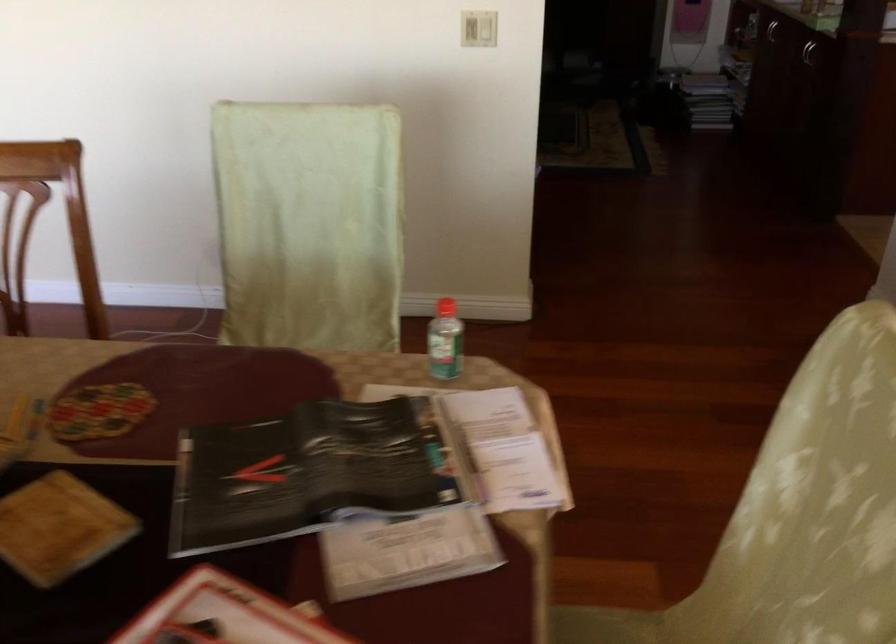
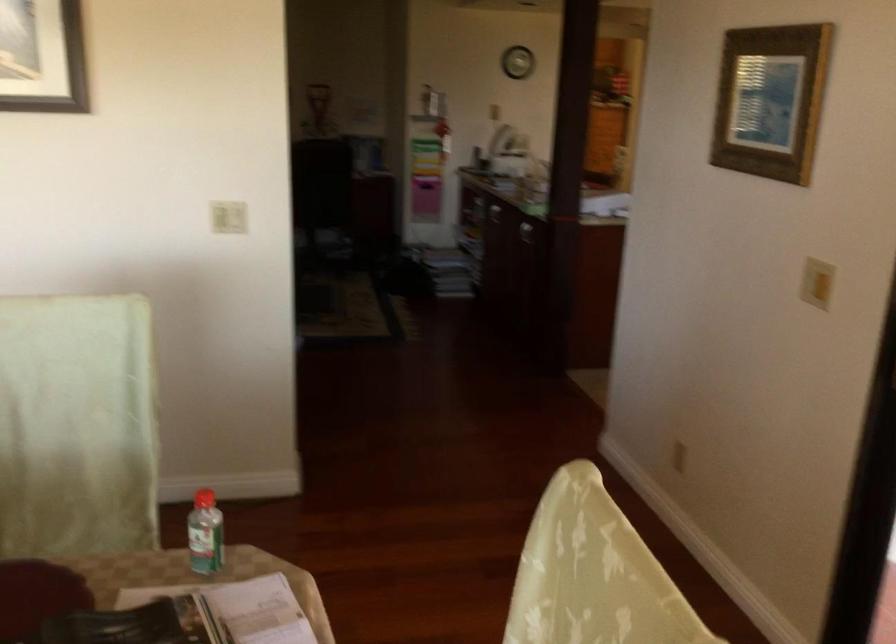
Find the pixel in the second image that matches the point at 474,409 in the first image.

(238, 609)